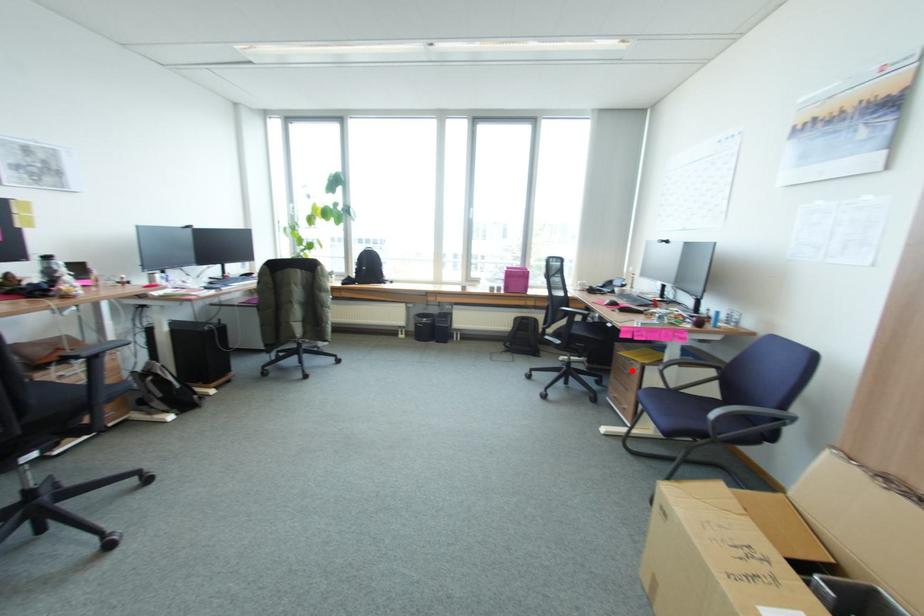
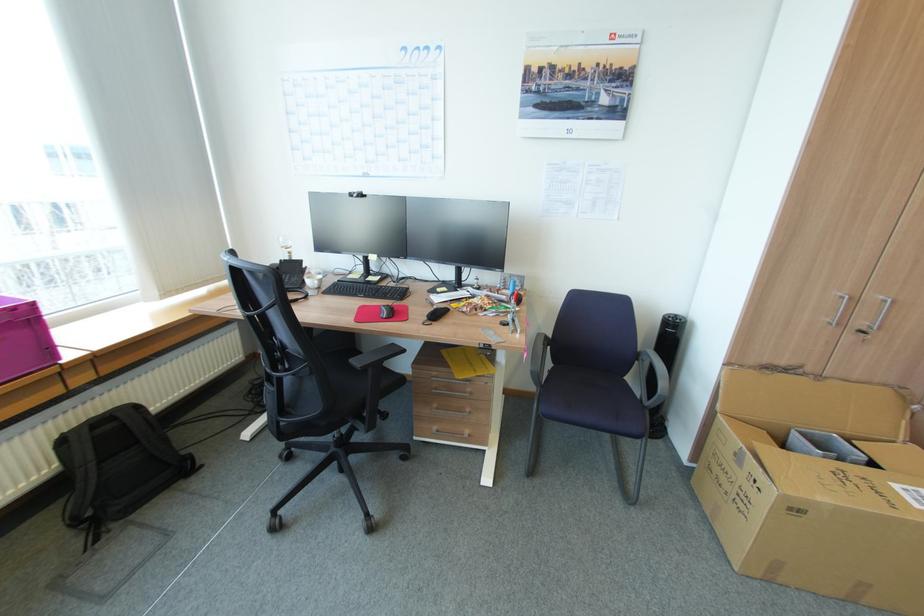
Question: I am providing you with two images of the same scene from different viewpoints. In image1, a red point is highlighted. Considering the same 3D point in image2, which of the following is correct?

Choices:
 (A) It is closer
 (B) It is farther

Answer: (B)